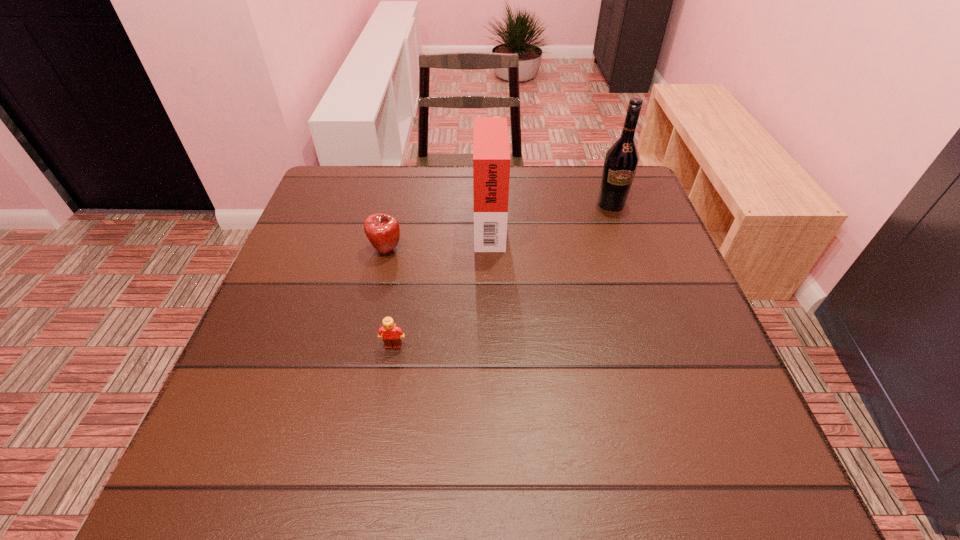
This screenshot has width=960, height=540. In the image, there is a desktop. Identify the location of vacant area at the far right corner. (597, 178).

At what (x,y) coordinates should I click in order to perform the action: click on blank region between the cigarette case and the apple. Please return your answer as a coordinate pair (x, y). This screenshot has height=540, width=960. Looking at the image, I should click on (438, 236).

The width and height of the screenshot is (960, 540). I want to click on free space between the wine bottle and the cigarette case, so click(x=550, y=213).

Identify the location of vacant space that is in between the cigarette case and the wine bottle. Image resolution: width=960 pixels, height=540 pixels. (550, 213).

Locate an element on the screen. empty location between the third object from left to right and the Lego is located at coordinates (x=442, y=284).

At what (x,y) coordinates should I click in order to perform the action: click on free space that is in between the rightmost object and the cigarette case. Please return your answer as a coordinate pair (x, y). Looking at the image, I should click on (550, 213).

What are the coordinates of `free space between the shortest object and the rightmost object` in the screenshot? It's located at (502, 275).

You are a GUI agent. You are given a task and a screenshot of the screen. Output one action in this format:
    pyautogui.click(x=<x>, y=<y>)
    Task: Click on the vacant space that's between the shortest object and the second shortest object
    
    Given the screenshot: What is the action you would take?
    pyautogui.click(x=390, y=299)

Where is `vacant space that is in between the cigarette case and the wine bottle`? This screenshot has height=540, width=960. vacant space that is in between the cigarette case and the wine bottle is located at coordinates (550, 213).

Identify which object is the second nearest to the rightmost object. Please provide its 2D coordinates. Your answer should be formatted as a tuple, i.e. [(x, y)], where the tuple contains the x and y coordinates of a point satisfying the conditions above.

[(382, 230)]